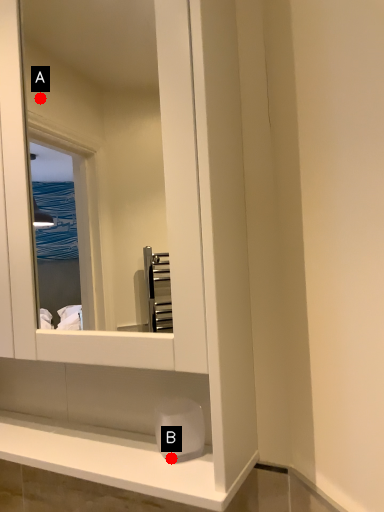
Question: Two points are circled on the image, labeled by A and B beside each circle. Which point appears farthest from the camera in this image?

Choices:
 (A) A is further
 (B) B is further

Answer: (A)